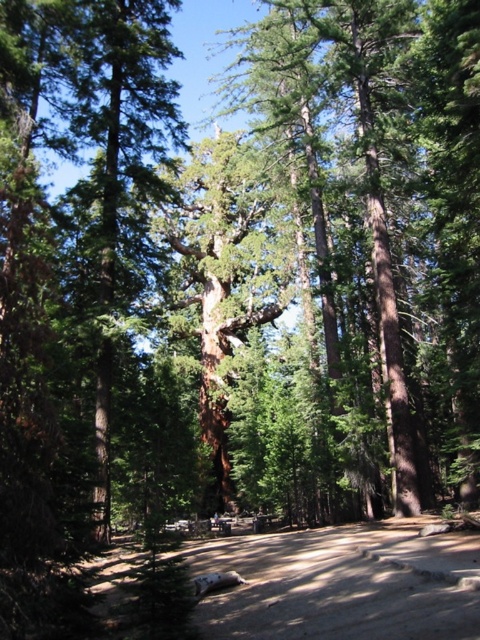
Which of these two, brown sandy dirt track at lower center or green rough bark tree at center, stands shorter?

brown sandy dirt track at lower center is shorter.

Between brown sandy dirt track at lower center and green rough bark tree at center, which one has more height?

Standing taller between the two is green rough bark tree at center.

Between point (272, 589) and point (282, 240), which one is positioned behind?

The point (282, 240) is behind.

Locate an element on the screen. This screenshot has width=480, height=640. brown sandy dirt track at lower center is located at coordinates (338, 586).